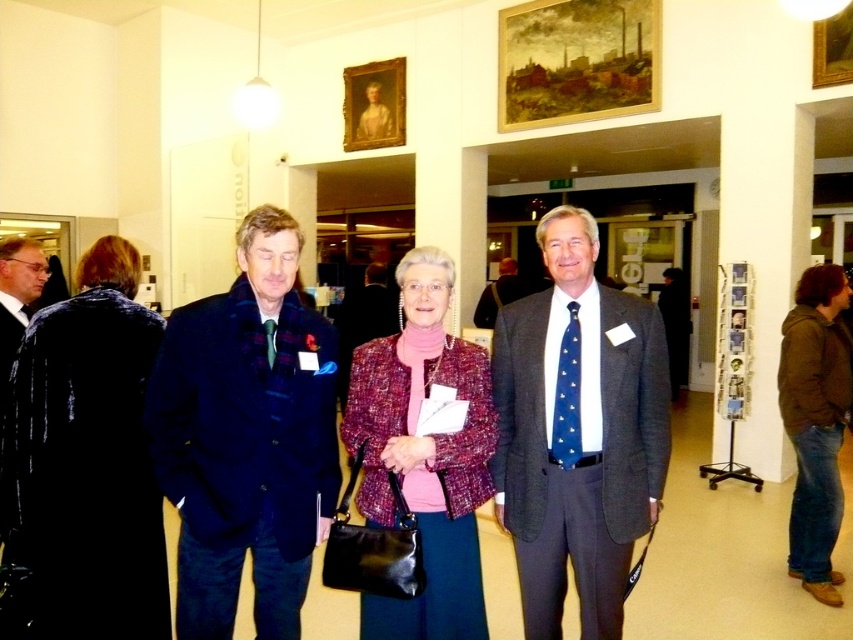
You are organizing a coat check at the event and need to decide which jacket to hang first. The plaid wool jacket at center and the denim jacket at lower right are both on a single narrow hanger. Which jacket should you hang first to ensure both fit on the hanger?

The plaid wool jacket at center is smaller than the denim jacket at lower right, so you should hang the denim jacket at lower right first to leave enough space for the smaller plaid wool jacket at center on the narrow hanger.